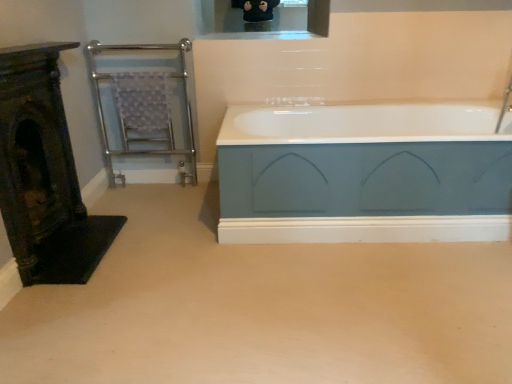
Question: Can you confirm if teal matte bathtub at center is thinner than chrome/metallic towel rail at left?

Choices:
 (A) yes
 (B) no

Answer: (B)

Question: Is teal matte bathtub at center far away from chrome/metallic towel rail at left?

Choices:
 (A) yes
 (B) no

Answer: (A)

Question: From a real-world perspective, does teal matte bathtub at center stand above chrome/metallic towel rail at left?

Choices:
 (A) yes
 (B) no

Answer: (B)

Question: Can you confirm if teal matte bathtub at center is smaller than chrome/metallic towel rail at left?

Choices:
 (A) yes
 (B) no

Answer: (B)

Question: Is teal matte bathtub at center oriented towards chrome/metallic towel rail at left?

Choices:
 (A) yes
 (B) no

Answer: (B)

Question: Can chrome/metallic towel rail at left be found inside teal matte bathtub at center?

Choices:
 (A) yes
 (B) no

Answer: (B)

Question: Is dark green ornate fireplace at left positioned with its back to chrome/metallic towel rail at left?

Choices:
 (A) yes
 (B) no

Answer: (B)

Question: Is dark green ornate fireplace at left touching chrome/metallic towel rail at left?

Choices:
 (A) no
 (B) yes

Answer: (A)

Question: Is dark green ornate fireplace at left positioned before chrome/metallic towel rail at left?

Choices:
 (A) yes
 (B) no

Answer: (A)

Question: From the image's perspective, is dark green ornate fireplace at left under chrome/metallic towel rail at left?

Choices:
 (A) yes
 (B) no

Answer: (A)

Question: Can you confirm if dark green ornate fireplace at left is taller than chrome/metallic towel rail at left?

Choices:
 (A) yes
 (B) no

Answer: (B)

Question: Is dark green ornate fireplace at left oriented towards chrome/metallic towel rail at left?

Choices:
 (A) no
 (B) yes

Answer: (A)

Question: From the image's perspective, is chrome/metallic towel rail at left on dark green ornate fireplace at left?

Choices:
 (A) yes
 (B) no

Answer: (A)